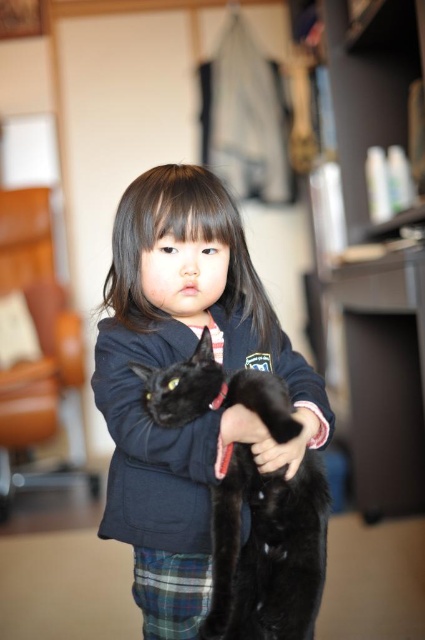
Question: Which point is closer to the camera?

Choices:
 (A) (254, 480)
 (B) (203, 609)

Answer: (A)

Question: Does shiny black cat at center appear on the right side of plaid fabric kilt at lower center?

Choices:
 (A) yes
 (B) no

Answer: (A)

Question: Is shiny black cat at center positioned before plaid fabric kilt at lower center?

Choices:
 (A) yes
 (B) no

Answer: (A)

Question: Which point is closer to the camera taking this photo?

Choices:
 (A) (176, 621)
 (B) (312, 547)

Answer: (B)

Question: Considering the relative positions of shiny black cat at center and plaid fabric kilt at lower center in the image provided, where is shiny black cat at center located with respect to plaid fabric kilt at lower center?

Choices:
 (A) below
 (B) above

Answer: (B)